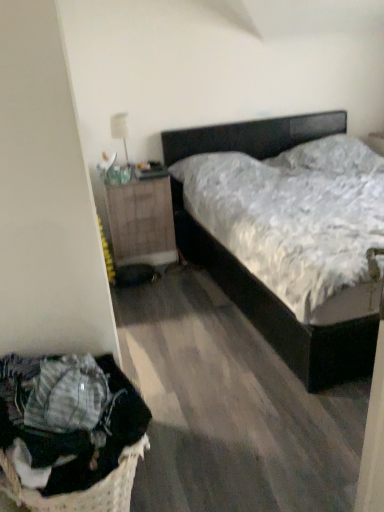
Question: Does black matte bed at center turn towards wooden nightstand at left?

Choices:
 (A) yes
 (B) no

Answer: (B)

Question: Considering the relative positions of black matte bed at center and wooden nightstand at left in the image provided, is black matte bed at center to the left of wooden nightstand at left from the viewer's perspective?

Choices:
 (A) yes
 (B) no

Answer: (B)

Question: Is black matte bed at center to the right of wooden nightstand at left from the viewer's perspective?

Choices:
 (A) yes
 (B) no

Answer: (A)

Question: From the image's perspective, is black matte bed at center on top of wooden nightstand at left?

Choices:
 (A) no
 (B) yes

Answer: (B)

Question: From the image's perspective, is black matte bed at center below wooden nightstand at left?

Choices:
 (A) no
 (B) yes

Answer: (A)

Question: Is black matte bed at center taller than wooden nightstand at left?

Choices:
 (A) no
 (B) yes

Answer: (B)

Question: Can you confirm if wooden nightstand at left is taller than black matte bed at center?

Choices:
 (A) yes
 (B) no

Answer: (B)

Question: Considering the relative sizes of wooden nightstand at left and black matte bed at center in the image provided, is wooden nightstand at left wider than black matte bed at center?

Choices:
 (A) no
 (B) yes

Answer: (A)

Question: Considering the relative sizes of wooden nightstand at left and black matte bed at center in the image provided, is wooden nightstand at left bigger than black matte bed at center?

Choices:
 (A) yes
 (B) no

Answer: (B)

Question: From a real-world perspective, is wooden nightstand at left over black matte bed at center?

Choices:
 (A) yes
 (B) no

Answer: (B)

Question: Does wooden nightstand at left appear on the left side of black matte bed at center?

Choices:
 (A) no
 (B) yes

Answer: (B)

Question: Does wooden nightstand at left have a lesser height compared to black matte bed at center?

Choices:
 (A) yes
 (B) no

Answer: (A)

Question: Considering the relative sizes of wooden nightstand at left and woven fabric laundry basket at lower left in the image provided, is wooden nightstand at left smaller than woven fabric laundry basket at lower left?

Choices:
 (A) yes
 (B) no

Answer: (B)